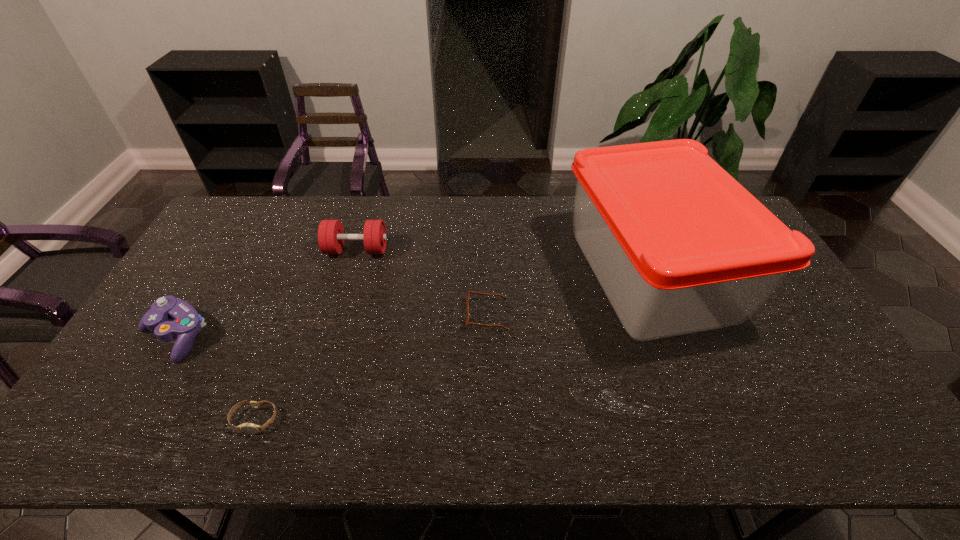
I want to click on blank region between the second tallest object and the spectacles, so click(x=421, y=282).

This screenshot has height=540, width=960. Find the location of `vacant point located between the spectacles and the control`. vacant point located between the spectacles and the control is located at coordinates (331, 325).

Find the location of a particular element. The height and width of the screenshot is (540, 960). object that is the second nearest to the leftmost object is located at coordinates (331, 236).

Find the location of a particular element. object that can be found as the fourth closest to the tray is located at coordinates (187, 323).

Identify the location of free location that satisfies the following two spatial constraints: 1. on the back side of the control; 2. on the right side of the tallest object. This screenshot has height=540, width=960. (213, 274).

What are the coordinates of `blank space that satisfies the following two spatial constraints: 1. on the back side of the rightmost object; 2. on the right side of the third shortest object` in the screenshot? It's located at (213, 274).